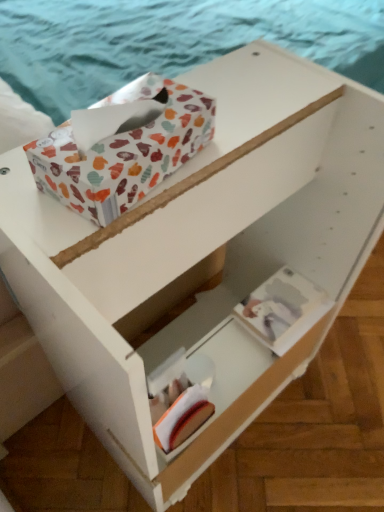
Locate an element on the screen. This screenshot has height=512, width=384. vacant space to the right of patterned paper tissue box at upper left is located at coordinates (238, 136).